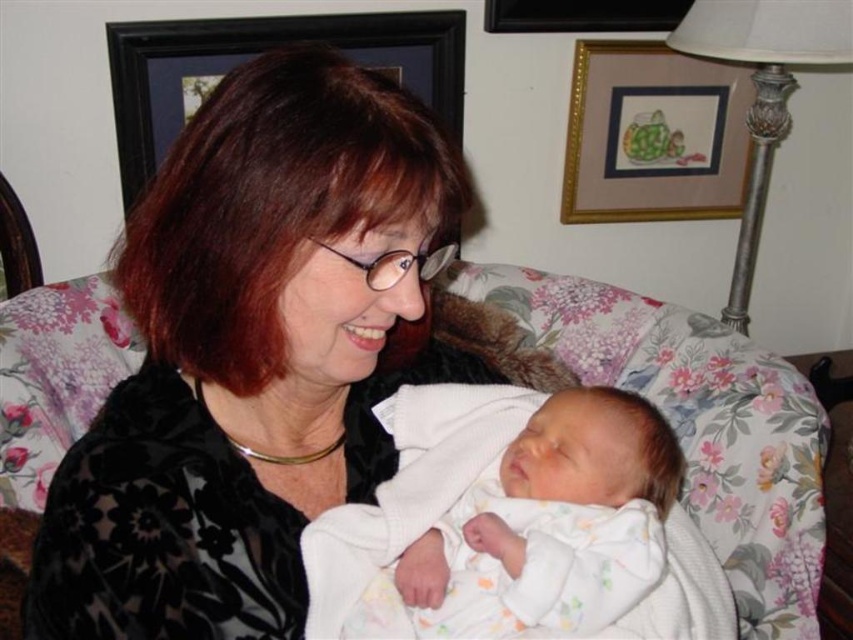
You are an interior designer assessing the wall above the couch. You notice the wooden picture frame at upper center and the black framed picture at upper center. Which one is narrower in width?

The wooden picture frame at upper center has a lesser width compared to the black framed picture at upper center, so it is narrower.

In the scene shown: You are an interior designer planning to place a new decorative item in the living room. You have the white soft fabric newborn at center and the black wooden picture frame at upper center in view. Which object should you consider if you need something bigger for the space?

The white soft fabric newborn at center has a larger size compared to the black wooden picture frame at upper center, so you should choose the white soft fabric newborn at center for the space.